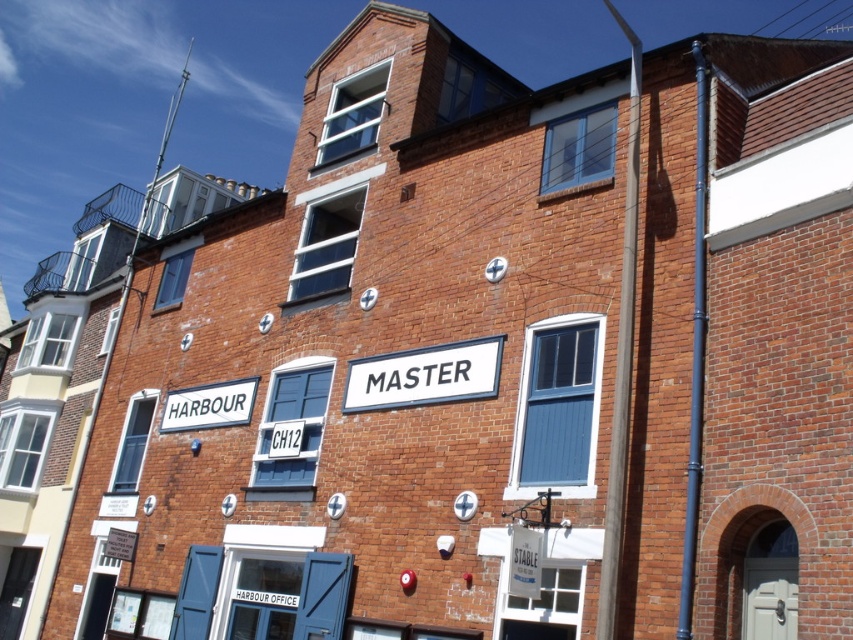
Is white plastic sign at center to the left of white painted wood sign at lower left from the viewer's perspective?

Incorrect, white plastic sign at center is not on the left side of white painted wood sign at lower left.

Which of these two, white plastic sign at center or white painted wood sign at lower left, stands taller?

With more height is white plastic sign at center.

Where is `white plastic sign at center`? The width and height of the screenshot is (853, 640). white plastic sign at center is located at coordinates (424, 376).

I want to click on white plastic sign at center, so click(424, 376).